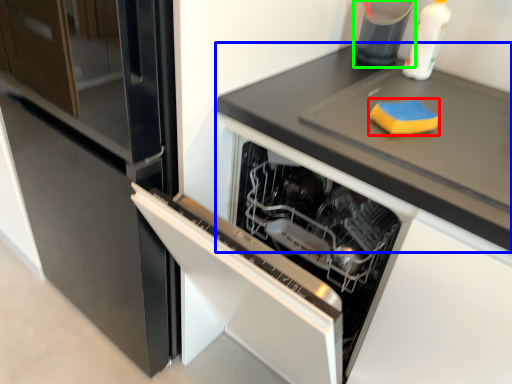
Question: Estimate the real-world distances between objects in this image. Which object is closer to food (highlighted by a red box), countertop (highlighted by a blue box) or appliance (highlighted by a green box)?

Choices:
 (A) countertop
 (B) appliance

Answer: (A)